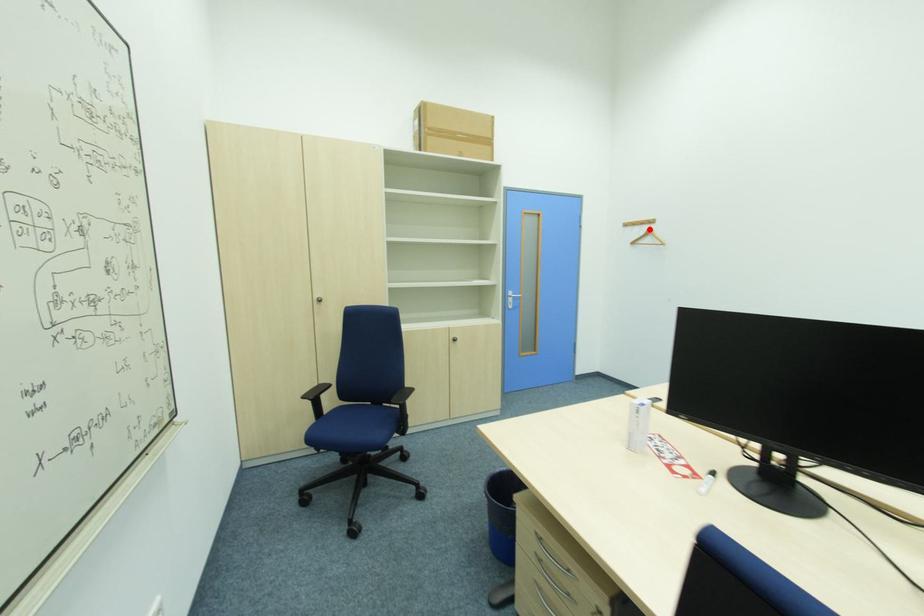
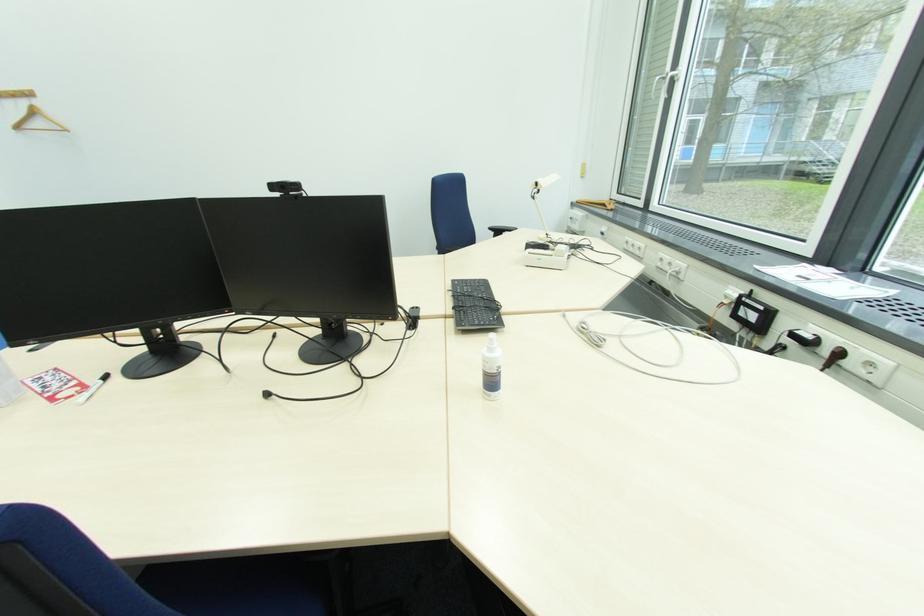
Question: I am providing you with two images of the same scene from different viewpoints. In image1, a red point is highlighted. Considering the same 3D point in image2, which of the following is correct?

Choices:
 (A) It is closer
 (B) It is farther

Answer: (B)